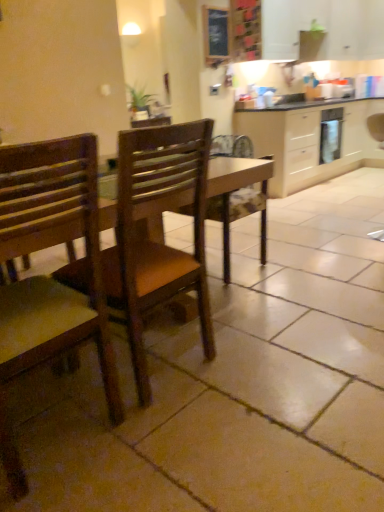
This screenshot has height=512, width=384. Describe the element at coordinates (216, 36) in the screenshot. I see `wooden frame at upper center` at that location.

This screenshot has height=512, width=384. Describe the element at coordinates (330, 135) in the screenshot. I see `satin silver oven at right` at that location.

Find the location of a particular element. The width and height of the screenshot is (384, 512). wooden chair at center, which is the 1th chair in right-to-left order is located at coordinates (154, 242).

You are a GUI agent. You are given a task and a screenshot of the screen. Output one action in this format:
    pyautogui.click(x=<x>, y=<y>)
    Task: Click on the wooden chair at left, the first chair when ordered from left to right
    The width and height of the screenshot is (384, 512).
    Given the screenshot: What is the action you would take?
    pyautogui.click(x=47, y=276)

You are a GUI agent. You are given a task and a screenshot of the screen. Output one action in this format:
    pyautogui.click(x=<x>, y=<y>)
    Task: Click on the wooden frame at upper center
    The height and width of the screenshot is (512, 384).
    Given the screenshot: What is the action you would take?
    pyautogui.click(x=216, y=36)

Is wooden chair at left, the first chair when ordered from left to right, outside of wooden frame at upper center?

Yes.

Consider the image. Can you confirm if wooden chair at left, the first chair when ordered from left to right, is wider than wooden frame at upper center?

Correct, the width of wooden chair at left, the first chair when ordered from left to right, exceeds that of wooden frame at upper center.

From the image's perspective, which object appears higher, wooden chair at left, the first chair when ordered from left to right, or wooden frame at upper center?

wooden frame at upper center is shown above in the image.

Does point (207, 64) lie behind point (283, 120)?

No.

Could you tell me if wooden frame at upper center is turned towards beige wood cabinetry at upper right?

No, wooden frame at upper center is not aimed at beige wood cabinetry at upper right.

From the image's perspective, is wooden frame at upper center on top of beige wood cabinetry at upper right?

Indeed, from the image's perspective, wooden frame at upper center is shown above beige wood cabinetry at upper right.

In the scene shown: Is wooden frame at upper center closer to the viewer compared to beige wood cabinetry at upper right?

Yes, wooden frame at upper center is closer to the camera.

Would you consider beige wood cabinetry at upper right to be distant from wooden frame at upper center?

Yes, beige wood cabinetry at upper right and wooden frame at upper center are located far from each other.

Is beige wood cabinetry at upper right spatially inside wooden frame at upper center, or outside of it?

beige wood cabinetry at upper right is located beyond the bounds of wooden frame at upper center.

Consider the image. From a real-world perspective, is beige wood cabinetry at upper right physically below wooden frame at upper center?

Yes, from a real-world perspective, beige wood cabinetry at upper right is below wooden frame at upper center.

I want to click on bulletin board above the beige wood cabinetry at upper right (from the image's perspective), so click(x=216, y=36).

Considering the positions of objects beige wood cabinetry at upper right and wooden chair at center, which is the 1th chair in right-to-left order, in the image provided, who is in front, beige wood cabinetry at upper right or wooden chair at center, which is the 1th chair in right-to-left order,?

wooden chair at center, which is the 1th chair in right-to-left order, is more forward.

From the image's perspective, is beige wood cabinetry at upper right located above or below wooden chair at center, the second chair positioned from the left?

Based on their image positions, beige wood cabinetry at upper right is located above wooden chair at center, the second chair positioned from the left.

Looking at the image, does beige wood cabinetry at upper right seem bigger or smaller compared to wooden chair at center, the second chair positioned from the left?

Clearly, beige wood cabinetry at upper right is larger in size than wooden chair at center, the second chair positioned from the left.

Which is more to the right, wooden chair at left, the first chair when ordered from left to right, or beige wood cabinetry at upper right?

Positioned to the right is beige wood cabinetry at upper right.

Considering the sizes of objects wooden chair at left, the first chair when ordered from left to right, and beige wood cabinetry at upper right in the image provided, who is bigger, wooden chair at left, the first chair when ordered from left to right, or beige wood cabinetry at upper right?

beige wood cabinetry at upper right.

Consider the image. Which object is thinner, wooden chair at left, the second chair in the right-to-left sequence, or beige wood cabinetry at upper right?

wooden chair at left, the second chair in the right-to-left sequence, is thinner.

Would you say wooden chair at left, the first chair when ordered from left to right, is inside or outside beige wood cabinetry at upper right?

The correct answer is: outside.

Based on the photo, does wooden chair at center, which is the 1th chair in right-to-left order, appear on the right side of satin silver oven at right?

No.

Is wooden chair at center, which is the 1th chair in right-to-left order, positioned before satin silver oven at right?

Yes, it is.

Would you say wooden chair at center, which is the 1th chair in right-to-left order, is outside satin silver oven at right?

wooden chair at center, which is the 1th chair in right-to-left order, lies outside satin silver oven at right's area.

Is wooden chair at left, the second chair in the right-to-left sequence, behind wooden chair at center, which is the 1th chair in right-to-left order?

That is False.

Visually, is wooden chair at left, the second chair in the right-to-left sequence, positioned to the left or to the right of wooden chair at center, which is the 1th chair in right-to-left order?

Based on their positions, wooden chair at left, the second chair in the right-to-left sequence, is located to the left of wooden chair at center, which is the 1th chair in right-to-left order.

Locate an element on the screen. chair positioned vertically above the wooden chair at left, the second chair in the right-to-left sequence (from a real-world perspective) is located at coordinates (154, 242).

In the scene shown: Is wooden chair at center, the second chair positioned from the left, completely or partially inside wooden chair at left, the first chair when ordered from left to right?

No, wooden chair at left, the first chair when ordered from left to right, does not contain wooden chair at center, the second chair positioned from the left.

Identify the location of bulletin board above the wooden chair at left, the second chair in the right-to-left sequence (from the image's perspective). Image resolution: width=384 pixels, height=512 pixels. (216, 36).

Find the location of a particular element. Image resolution: width=384 pixels, height=512 pixels. cabinetry below the wooden frame at upper center (from the image's perspective) is located at coordinates (309, 142).

Considering their positions, is satin silver oven at right positioned further to beige wood cabinetry at upper right than wooden chair at left, the first chair when ordered from left to right?

wooden chair at left, the first chair when ordered from left to right.

Considering their positions, is wooden frame at upper center positioned closer to satin silver oven at right than wooden chair at center, the second chair positioned from the left?

wooden frame at upper center.

Based on their spatial positions, is satin silver oven at right or wooden frame at upper center further from wooden chair at center, which is the 1th chair in right-to-left order?

satin silver oven at right.

Which object lies nearer to the anchor point wooden chair at left, the second chair in the right-to-left sequence, satin silver oven at right or wooden frame at upper center?

wooden frame at upper center is positioned closer to the anchor wooden chair at left, the second chair in the right-to-left sequence.

Estimate the real-world distances between objects in this image. Which object is closer to beige wood cabinetry at upper right, wooden chair at left, the second chair in the right-to-left sequence, or wooden chair at center, which is the 1th chair in right-to-left order?

Based on the image, wooden chair at center, which is the 1th chair in right-to-left order, appears to be nearer to beige wood cabinetry at upper right.

From the image, which object appears to be farther from wooden frame at upper center, wooden chair at center, the second chair positioned from the left, or satin silver oven at right?

wooden chair at center, the second chair positioned from the left, is positioned further to the anchor wooden frame at upper center.

Considering their positions, is beige wood cabinetry at upper right positioned further to wooden chair at left, the first chair when ordered from left to right, than wooden frame at upper center?

Among the two, beige wood cabinetry at upper right is located further to wooden chair at left, the first chair when ordered from left to right.

Considering their positions, is wooden frame at upper center positioned further to wooden chair at center, which is the 1th chair in right-to-left order, than wooden chair at left, the first chair when ordered from left to right?

wooden frame at upper center is further to wooden chair at center, which is the 1th chair in right-to-left order.

You are a GUI agent. You are given a task and a screenshot of the screen. Output one action in this format:
    pyautogui.click(x=<x>, y=<y>)
    Task: Click on the bulletin board between wooden chair at center, which is the 1th chair in right-to-left order, and satin silver oven at right in the front-back direction
    The width and height of the screenshot is (384, 512).
    Given the screenshot: What is the action you would take?
    pyautogui.click(x=216, y=36)

I want to click on chair positioned between wooden chair at left, the first chair when ordered from left to right, and satin silver oven at right from near to far, so click(x=154, y=242).

The height and width of the screenshot is (512, 384). I want to click on appliance situated between wooden frame at upper center and beige wood cabinetry at upper right from left to right, so click(x=330, y=135).

The height and width of the screenshot is (512, 384). Find the location of `cabinetry between wooden chair at left, the second chair in the right-to-left sequence, and satin silver oven at right from front to back`. cabinetry between wooden chair at left, the second chair in the right-to-left sequence, and satin silver oven at right from front to back is located at coordinates (309, 142).